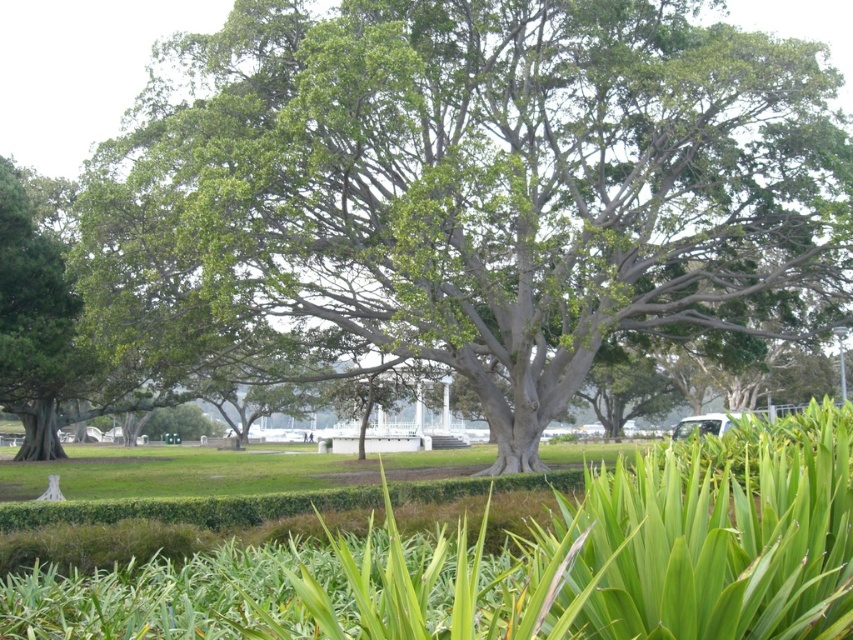
Question: Does green leafy tree at center have a larger size compared to green leafy grass at center?

Choices:
 (A) yes
 (B) no

Answer: (A)

Question: Is green leafy tree at center above green leafy grass at center?

Choices:
 (A) yes
 (B) no

Answer: (A)

Question: Which point is farther to the camera?

Choices:
 (A) green leafy tree at center
 (B) green leafy grass at center

Answer: (A)

Question: Considering the relative positions of green leafy tree at center and green leafy grass at center in the image provided, where is green leafy tree at center located with respect to green leafy grass at center?

Choices:
 (A) right
 (B) left

Answer: (A)